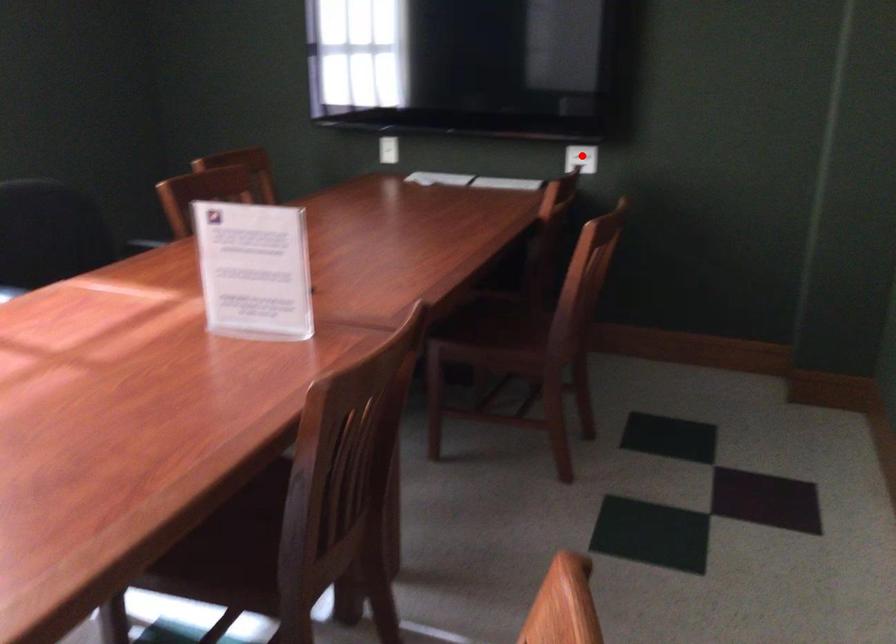
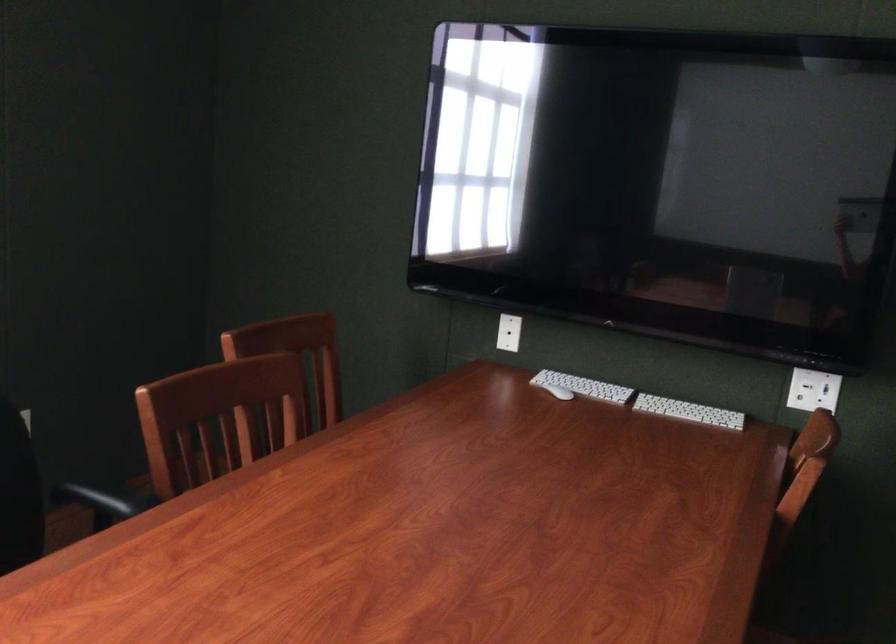
Where in the second image is the point corresponding to the highlighted location from the first image?

(813, 390)